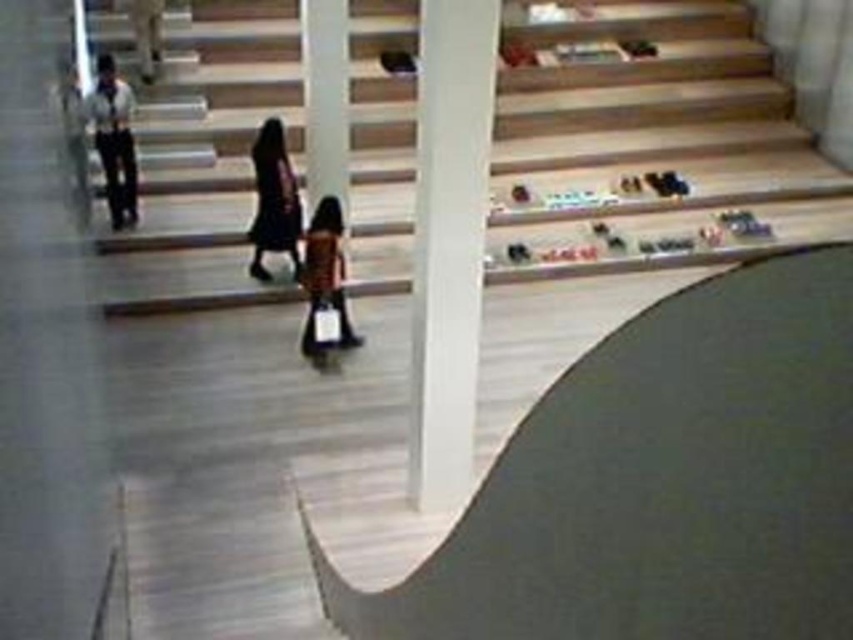
You are standing in the modern space and want to determine if the wooden stairs at center are taller than the white shirt at left. Based on the scene description, can you confirm this?

Yes, the wooden stairs at center are taller than the white shirt at left according to the provided description.

You are standing in the modern space described. You see the white glossy pillar at center and the matte black jacket at upper left. Which object is positioned higher up in the image?

The matte black jacket at upper left is positioned higher up in the image than the white glossy pillar at center.